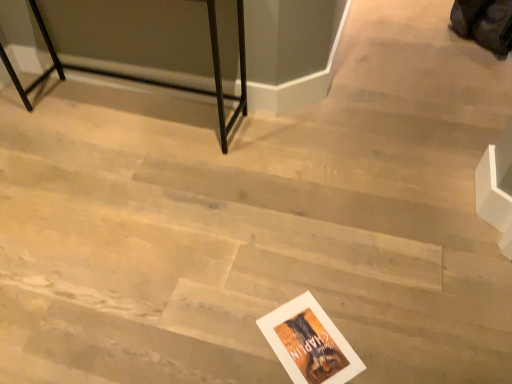
You are a GUI agent. You are given a task and a screenshot of the screen. Output one action in this format:
    pyautogui.click(x=<x>, y=<y>)
    Task: Click on the vacant location below black metal table at upper left (from a real-world perspective)
    
    Given the screenshot: What is the action you would take?
    pyautogui.click(x=114, y=110)